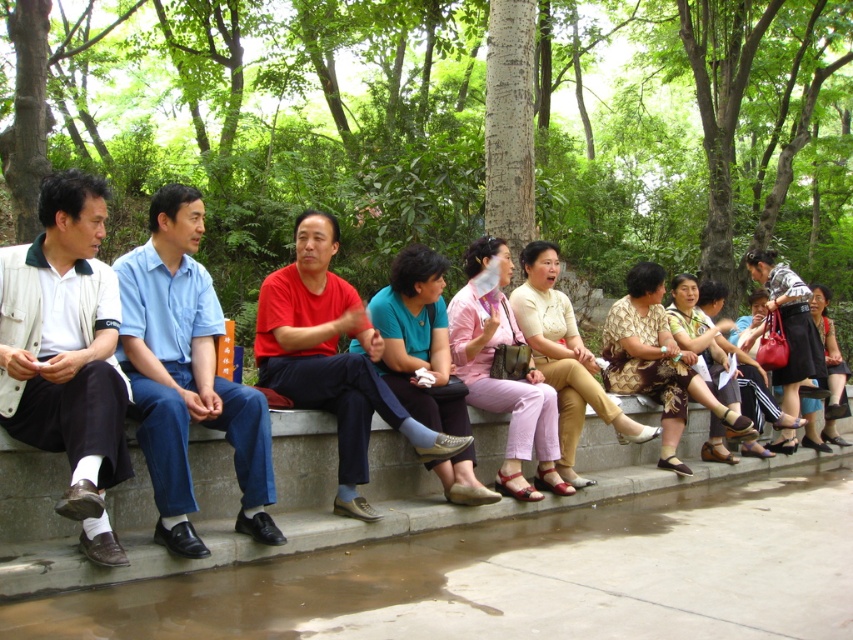
Question: Which object is positioned farthest from the light beige jacket at left?

Choices:
 (A) gray concrete curb at lower center
 (B) blue cotton shirt at center
 (C) red matte shirt at center

Answer: (A)

Question: Does gray concrete curb at lower center appear under light beige jacket at left?

Choices:
 (A) no
 (B) yes

Answer: (B)

Question: Can you confirm if blue cotton shirt at center is positioned to the left of red matte shirt at center?

Choices:
 (A) yes
 (B) no

Answer: (A)

Question: Which object appears closest to the camera in this image?

Choices:
 (A) red matte shirt at center
 (B) blue cotton shirt at center
 (C) gray concrete curb at lower center

Answer: (B)

Question: Which point is farther to the camera?

Choices:
 (A) (183, 298)
 (B) (294, 234)
 (C) (117, 472)
 (D) (207, 528)

Answer: (B)

Question: Is light beige jacket at left to the left of red matte shirt at center from the viewer's perspective?

Choices:
 (A) no
 (B) yes

Answer: (B)